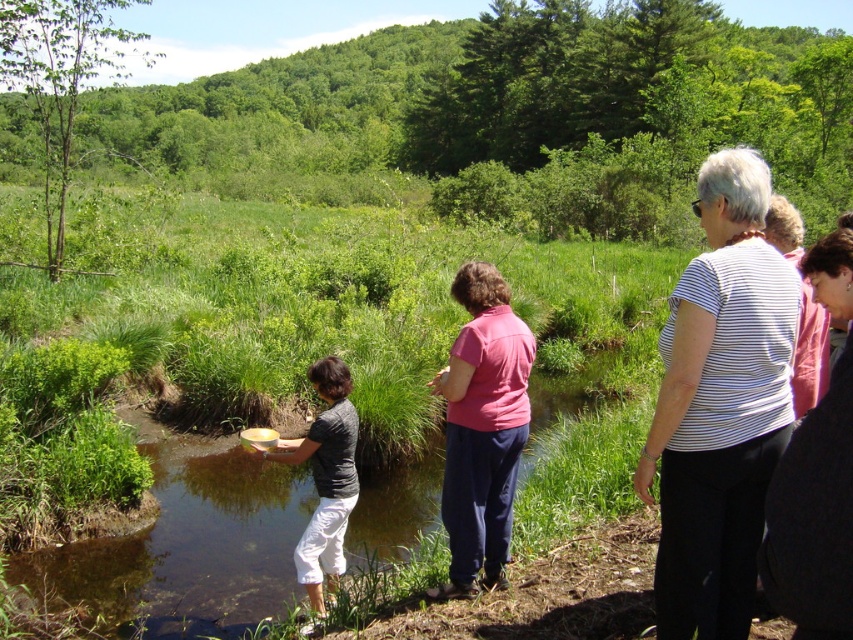
You are a photographer positioned at the edge of the stream. You want to capture a photo that includes both the white striped shirt at right and the pink cotton shirt at center. Based on their positions, which shirt should you adjust your camera angle to focus on first to ensure both are in the frame?

The white striped shirt at right is located below the pink cotton shirt at center, so you should first focus your camera angle on the pink cotton shirt at center to ensure both are visible in the frame.

You are standing at the edge of the stream in the scene. There are two points marked in the image. Which point, point 1 at coordinates (711, 593) or point 2 at coordinates (509, 515), is closer to you?

Point 1 at coordinates (711, 593) is closer to you because it is closer to the camera than point 2 at coordinates (509, 515).

You are standing at the point labeled as point (720, 404) in the image. What object or person is located at that position?

The point (720, 404) indicates a white striped shirt at right.